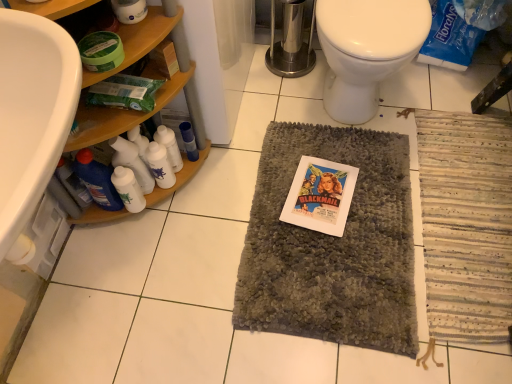
The height and width of the screenshot is (384, 512). What are the coordinates of `vacant space in front of woodenshelves at left` in the screenshot? It's located at (248, 186).